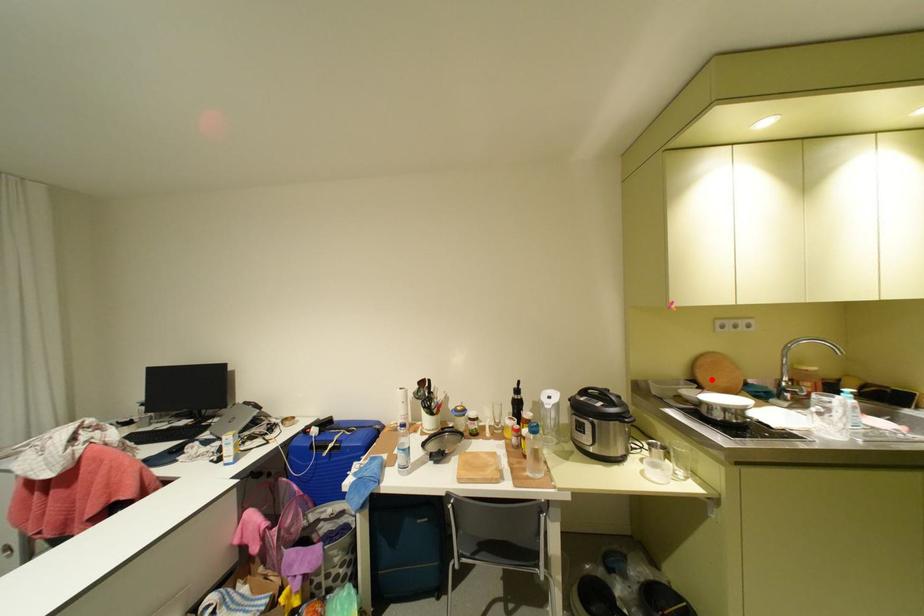
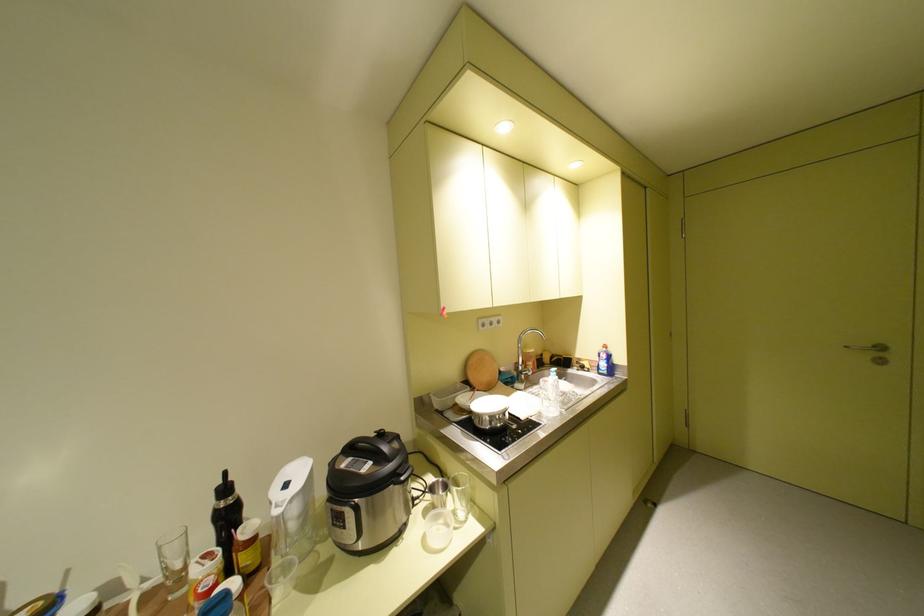
Question: I am providing you with two images of the same scene from different viewpoints. A red point is shown in image1. For the corresponding object point in image2, is it positioned nearer or farther from the camera?

Choices:
 (A) Nearer
 (B) Farther

Answer: (B)